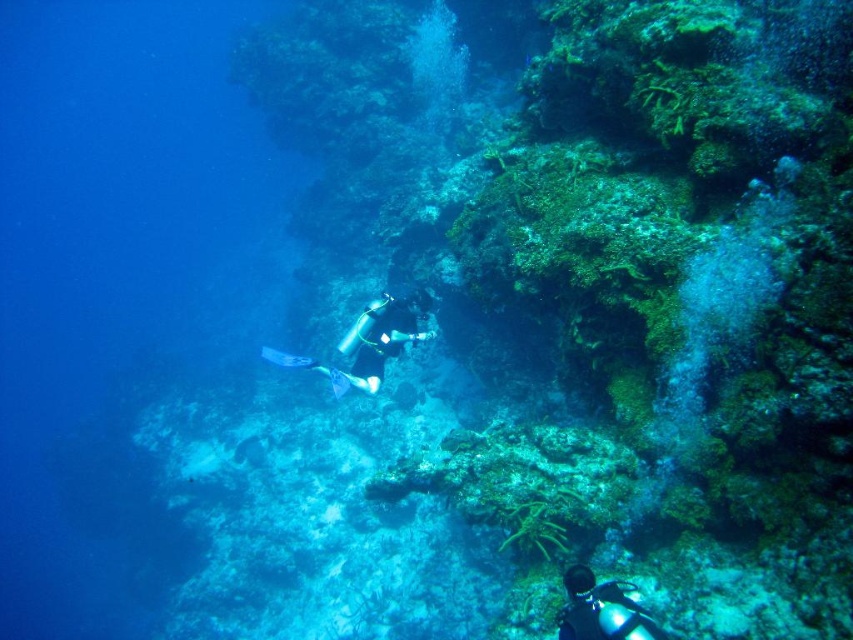
You are a marine biologist planning to place a research buoy in the center of the underwater scene. The buoy has a radius of 0.1 units. Based on the coordinates provided, will the black matte scuba diver at center interfere with the buoy?

The black matte scuba diver at center is located at coordinates point (379, 339). The research buoy is placed at the center, which is point (426, 320). The distance between them is sqrt of squared differences in x and y coordinates. Calculating the distance between 0.531 and 0.5 in x and 0.445 and 0.5 in y. The distance squared would be 0.000961 plus 0.000225, totaling 0.001186. The square root of that is approximately 0.0344 units. Since the buoy has a radius of 0.1 units, the diver is within the buoy area

You are a marine biologist observing the underwater scene. You need to determine which diver has a wider silhouette between the black matte scuba diver at center and the glossy blue diving suit at lower right. Which diver is wider?

The black matte scuba diver at center might be wider than glossy blue diving suit at lower right, so the black matte scuba diver at center has a wider silhouette.